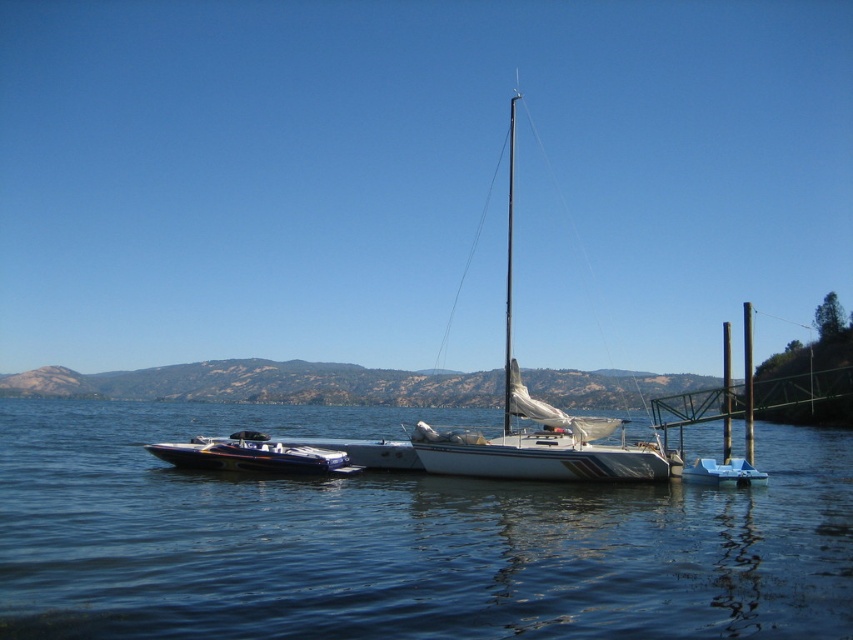
Does point (215, 456) come in front of point (697, 460)?

Yes, it is.

Between glossy blue boat at lower left and blue plastic boat at lower right, which one appears on the left side from the viewer's perspective?

glossy blue boat at lower left

Image resolution: width=853 pixels, height=640 pixels. What are the coordinates of `glossy blue boat at lower left` in the screenshot? It's located at (253, 456).

You are a GUI agent. You are given a task and a screenshot of the screen. Output one action in this format:
    pyautogui.click(x=<x>, y=<y>)
    Task: Click on the glossy blue boat at lower left
    Image resolution: width=853 pixels, height=640 pixels.
    Given the screenshot: What is the action you would take?
    pyautogui.click(x=253, y=456)

Which is more to the left, clear water at center or blue plastic boat at lower right?

clear water at center is more to the left.

Who is more forward, (595,545) or (693,470)?

Point (595,545) is in front.

The image size is (853, 640). What are the coordinates of `clear water at center` in the screenshot? It's located at (399, 538).

Locate an element on the screen. Image resolution: width=853 pixels, height=640 pixels. clear water at center is located at coordinates (399, 538).

Can you confirm if clear water at center is bigger than white matte sailboat at center?

Actually, clear water at center might be smaller than white matte sailboat at center.

Image resolution: width=853 pixels, height=640 pixels. Find the location of `clear water at center`. clear water at center is located at coordinates (399, 538).